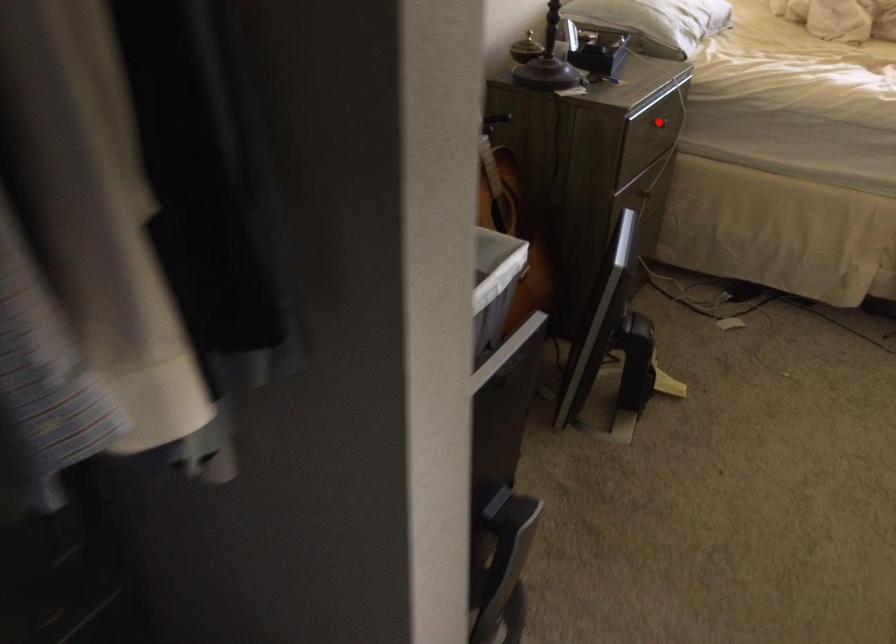
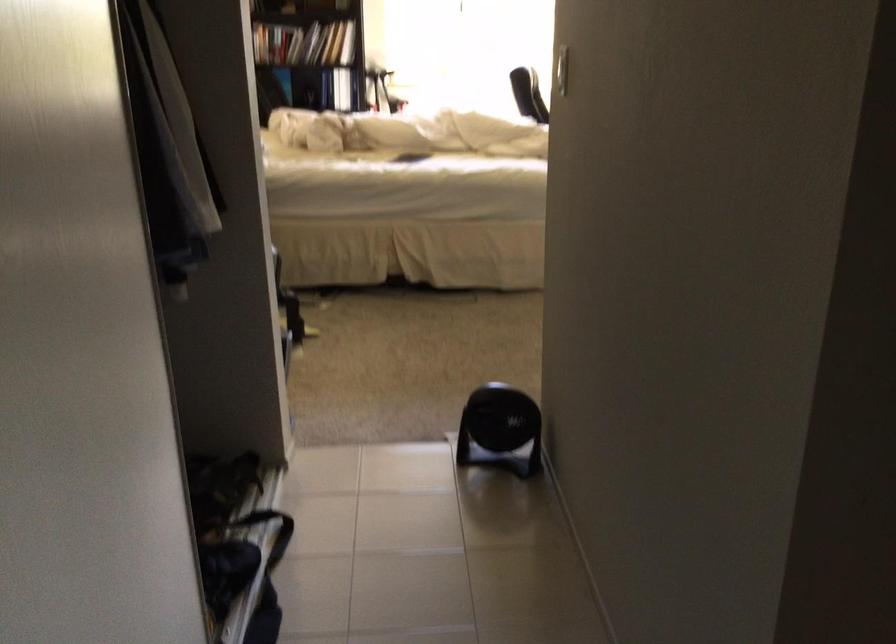
Question: I am providing you with two images of the same scene from different viewpoints. A red point is marked on the first image. Can you still see the location of the red point in image 2?

Choices:
 (A) Yes
 (B) No

Answer: (B)